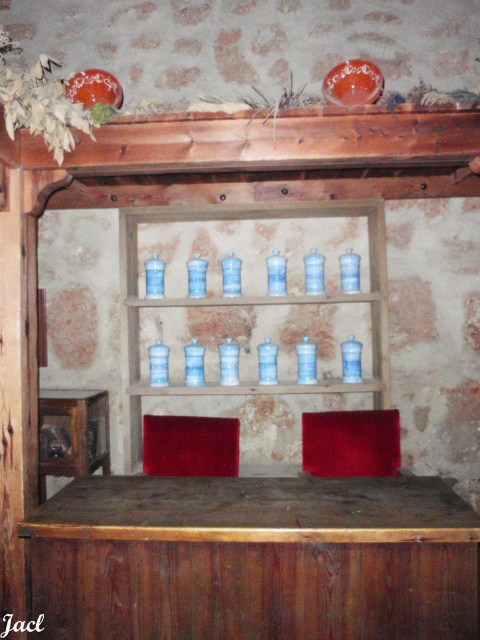
Question: Does blue glass jars at center have a lesser width compared to blue glass bottles at center?

Choices:
 (A) no
 (B) yes

Answer: (A)

Question: Which of the following is the closest to the observer?

Choices:
 (A) (339, 387)
 (B) (373, 278)

Answer: (A)

Question: Can you confirm if blue glass jars at center is positioned to the left of blue glass bottles at center?

Choices:
 (A) yes
 (B) no

Answer: (A)

Question: Which point is closer to the camera?

Choices:
 (A) (340, 209)
 (B) (123, 301)

Answer: (B)

Question: Is blue glass jars at center further to the viewer compared to blue glass bottles at center?

Choices:
 (A) yes
 (B) no

Answer: (A)